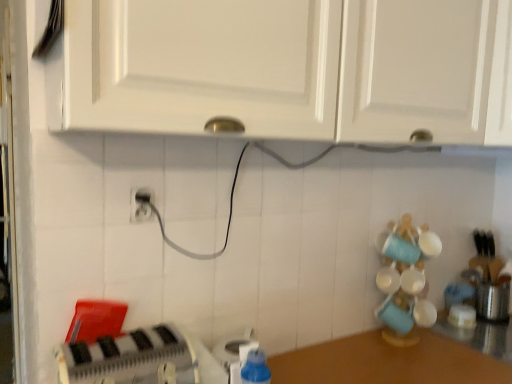
Question: Visually, is white matte cabinet at upper center, placed as the 1th cabinetry when sorted from left to right, positioned to the left or to the right of white matte cabinet at upper center, arranged as the 1th cabinetry when viewed from the right?

Choices:
 (A) left
 (B) right

Answer: (A)

Question: Is white matte cabinet at upper center, placed as the 1th cabinetry when sorted from left to right, taller or shorter than white matte cabinet at upper center, arranged as the 1th cabinetry when viewed from the right?

Choices:
 (A) tall
 (B) short

Answer: (B)

Question: Which object is the closest to the blue plastic bottle at lower center?

Choices:
 (A) white plastic electric outlet at center
 (B) satin silver toaster at right, marked as the third appliance in a left-to-right arrangement
 (C) white matte cabinet at upper center, placed as the 2th cabinetry when sorted from right to left
 (D) brown wooden counter at lower right
 (E) white plastic toaster at lower left, the first appliance viewed from the left

Answer: (E)

Question: Which object is the closest to the white matte cabinet at upper center, placed as the 1th cabinetry when sorted from left to right?

Choices:
 (A) white ceramic mug at right
 (B) brown wooden counter at lower right
 (C) satin silver toaster at right, the 1th appliance in the right-to-left sequence
 (D) white plastic electric outlet at center
 (E) white matte cabinet at upper center, arranged as the 2th cabinetry when viewed from the left

Answer: (E)